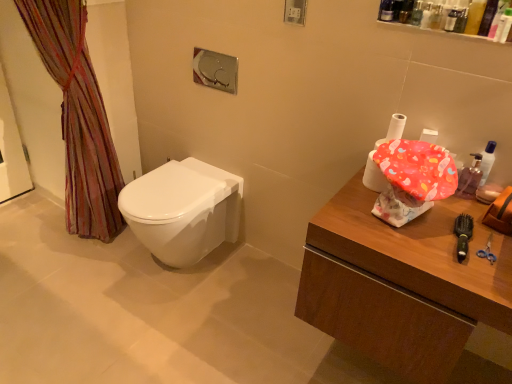
The height and width of the screenshot is (384, 512). Describe the element at coordinates (183, 210) in the screenshot. I see `white glossy toilet at center` at that location.

The width and height of the screenshot is (512, 384). What do you see at coordinates (504, 27) in the screenshot?
I see `white plastic bottle at upper right, the 1th mouthwash from the top` at bounding box center [504, 27].

Locate an element on the screen. The height and width of the screenshot is (384, 512). multicolored fabric curtain at left is located at coordinates (78, 117).

How much space does translucent plastic container at upper right, which ranks as the 2th toiletry in left-to-right order, occupy horizontally?

2.70 inches.

Find the location of a particular element. The height and width of the screenshot is (384, 512). translucent plastic mouthwash at upper right, which appears as the second mouthwash when viewed from the front is located at coordinates (470, 176).

The height and width of the screenshot is (384, 512). Describe the element at coordinates (470, 176) in the screenshot. I see `translucent plastic mouthwash at upper right, marked as the second mouthwash in a top-to-bottom arrangement` at that location.

Identify the location of white glossy toilet at center. This screenshot has height=384, width=512. (183, 210).

From a real-world perspective, is white glossy toilet at center physically located above or below matte pink fabric toilet paper at right?

white glossy toilet at center is below matte pink fabric toilet paper at right.

Is point (144, 234) closer to camera compared to point (370, 176)?

That is False.

Is the depth of white glossy toilet at center less than that of matte pink fabric toilet paper at right?

No, white glossy toilet at center is further to the viewer.

Based on the photo, which object is further away from the camera, wooden counter at right or green plastic brush at right?

green plastic brush at right is further from the camera.

Is point (416, 238) positioned before point (470, 226)?

Yes, point (416, 238) is closer to viewer.

Consider the image. Considering the sizes of wooden counter at right and green plastic brush at right in the image, is wooden counter at right taller or shorter than green plastic brush at right?

In the image, wooden counter at right appears to be taller than green plastic brush at right.

Image resolution: width=512 pixels, height=384 pixels. Identify the location of brush on the right of wooden counter at right. (463, 235).

Locate an element on the screen. The width and height of the screenshot is (512, 384). curtain below the matte pink fabric toilet paper at right (from a real-world perspective) is located at coordinates pos(78,117).

Considering the sizes of objects matte pink fabric toilet paper at right and multicolored fabric curtain at left in the image provided, who is shorter, matte pink fabric toilet paper at right or multicolored fabric curtain at left?

Standing shorter between the two is matte pink fabric toilet paper at right.

Can you confirm if matte pink fabric toilet paper at right is thinner than multicolored fabric curtain at left?

Indeed, matte pink fabric toilet paper at right has a lesser width compared to multicolored fabric curtain at left.

Between wooden counter at right and translucent plastic container at upper right, which is the 1th toiletry from right to left, which one appears on the left side from the viewer's perspective?

From the viewer's perspective, translucent plastic container at upper right, which is the 1th toiletry from right to left, appears more on the left side.

From the picture: From the image's perspective, which is above, wooden counter at right or translucent plastic container at upper right, which is the 1th toiletry from right to left?

translucent plastic container at upper right, which is the 1th toiletry from right to left, is shown above in the image.

From their relative heights in the image, would you say wooden counter at right is taller or shorter than translucent plastic container at upper right, which is the 1th toiletry from right to left?

Clearly, wooden counter at right is taller compared to translucent plastic container at upper right, which is the 1th toiletry from right to left.

Could you tell me if wooden counter at right is facing translucent plastic container at upper right, which ranks as the 2th toiletry in left-to-right order?

No, wooden counter at right is not oriented towards translucent plastic container at upper right, which ranks as the 2th toiletry in left-to-right order.

From a real-world perspective, which object rests below the other?

In real-world perspective, translucent plastic mouthwash at upper right, marked as the second mouthwash in a top-to-bottom arrangement, is lower.

How much distance is there between translucent plastic bottles at upper right, which is the second toiletry from right to left, and translucent plastic mouthwash at upper right, which appears as the second mouthwash when viewed from the front?

translucent plastic bottles at upper right, which is the second toiletry from right to left, is 23.05 inches away from translucent plastic mouthwash at upper right, which appears as the second mouthwash when viewed from the front.

Is translucent plastic bottles at upper right, which is the second toiletry from right to left, shorter than translucent plastic mouthwash at upper right, which appears as the second mouthwash when viewed from the front?

Indeed, translucent plastic bottles at upper right, which is the second toiletry from right to left, has a lesser height compared to translucent plastic mouthwash at upper right, which appears as the second mouthwash when viewed from the front.

Is translucent plastic mouthwash at upper right, the 1th mouthwash when ordered from back to front, a part of translucent plastic bottles at upper right, which appears as the first toiletry when viewed from the left?

No, translucent plastic mouthwash at upper right, the 1th mouthwash when ordered from back to front, is not inside translucent plastic bottles at upper right, which appears as the first toiletry when viewed from the left.

Image resolution: width=512 pixels, height=384 pixels. In order to click on mouthwash that is the 1st object located in front of the multicolored fabric curtain at left in this screenshot , I will do point(470,176).

Which point is more forward, (x=471, y=184) or (x=115, y=151)?

The point (x=471, y=184) is closer.

What's the angular difference between translucent plastic mouthwash at upper right, which appears as the first mouthwash when ordered from the bottom, and multicolored fabric curtain at left's facing directions?

The angular difference between translucent plastic mouthwash at upper right, which appears as the first mouthwash when ordered from the bottom, and multicolored fabric curtain at left is 96.1 degrees.

From a real-world perspective, which object rests below the other?

multicolored fabric curtain at left.

Is white glossy toilet at center next to translucent plastic bottles at upper right, which appears as the first toiletry when viewed from the left?

No, white glossy toilet at center is not with translucent plastic bottles at upper right, which appears as the first toiletry when viewed from the left.

Who is bigger, white glossy toilet at center or translucent plastic bottles at upper right, which appears as the first toiletry when viewed from the left?

With larger size is white glossy toilet at center.

Could you tell me if white glossy toilet at center is facing translucent plastic bottles at upper right, which appears as the first toiletry when viewed from the left?

No, white glossy toilet at center is not oriented towards translucent plastic bottles at upper right, which appears as the first toiletry when viewed from the left.

Which object is further away from the camera, white glossy toilet at center or translucent plastic bottles at upper right, which appears as the first toiletry when viewed from the left?

white glossy toilet at center is further away from the camera.

At what (x,y) coordinates should I click in order to perform the action: click on toilet located on the left of matte pink fabric toilet paper at right. Please return your answer as a coordinate pair (x, y). Looking at the image, I should click on (183, 210).

Locate an element on the screen. The image size is (512, 384). counter in front of the green plastic brush at right is located at coordinates (402, 283).

When comparing their distances from translucent plastic container at upper right, which is the 1th toiletry from right to left, does white plastic bottle at upper right, the second mouthwash positioned from the bottom, or white glossy toilet at center seem closer?

white plastic bottle at upper right, the second mouthwash positioned from the bottom.

Based on their spatial positions, is wooden counter at right or translucent plastic bottles at upper right, which appears as the first toiletry when viewed from the left, further from translucent plastic container at upper right, which is the 1th toiletry from right to left?

wooden counter at right is positioned further to the anchor translucent plastic container at upper right, which is the 1th toiletry from right to left.

Estimate the real-world distances between objects in this image. Which object is further from white plastic bottle at upper right, the second mouthwash positioned from the bottom, translucent plastic container at upper right, which ranks as the 2th toiletry in left-to-right order, or translucent plastic mouthwash at upper right, marked as the second mouthwash in a top-to-bottom arrangement?

The object further to white plastic bottle at upper right, the second mouthwash positioned from the bottom, is translucent plastic mouthwash at upper right, marked as the second mouthwash in a top-to-bottom arrangement.

When comparing their distances from translucent plastic bottles at upper right, which appears as the first toiletry when viewed from the left, does green plastic brush at right or wooden counter at right seem further?

Based on the image, wooden counter at right appears to be further to translucent plastic bottles at upper right, which appears as the first toiletry when viewed from the left.

Which object lies nearer to the anchor point multicolored fabric curtain at left, matte pink fabric toilet paper at right or white glossy toilet at center?

white glossy toilet at center is positioned closer to the anchor multicolored fabric curtain at left.

Looking at the image, which one is located further to translucent plastic bottles at upper right, which appears as the first toiletry when viewed from the left, translucent plastic container at upper right, which is the 1th toiletry from right to left, or translucent plastic mouthwash at upper right, which appears as the second mouthwash when viewed from the front?

translucent plastic mouthwash at upper right, which appears as the second mouthwash when viewed from the front.

When comparing their distances from white glossy toilet at center, does green plastic brush at right or matte pink fabric toilet paper at right seem further?

green plastic brush at right is positioned further to the anchor white glossy toilet at center.

Considering their positions, is white plastic bottle at upper right, positioned as the first mouthwash in front-to-back order, positioned closer to multicolored fabric curtain at left than translucent plastic bottles at upper right, which is the second toiletry from right to left?

translucent plastic bottles at upper right, which is the second toiletry from right to left, is positioned closer to the anchor multicolored fabric curtain at left.

I want to click on toiletry between translucent plastic bottles at upper right, which appears as the first toiletry when viewed from the left, and green plastic brush at right vertically, so click(x=406, y=11).

This screenshot has width=512, height=384. In order to click on toilet paper between translucent plastic bottles at upper right, which appears as the first toiletry when viewed from the left, and wooden counter at right in the up-down direction in this screenshot , I will do `click(373, 175)`.

Locate an element on the screen. The height and width of the screenshot is (384, 512). toilet paper located between white glossy toilet at center and wooden counter at right in the left-right direction is located at coordinates (373, 175).

This screenshot has width=512, height=384. What are the coordinates of `brush between wooden counter at right and matte pink fabric toilet paper at right in the front-back direction` in the screenshot? It's located at (463, 235).